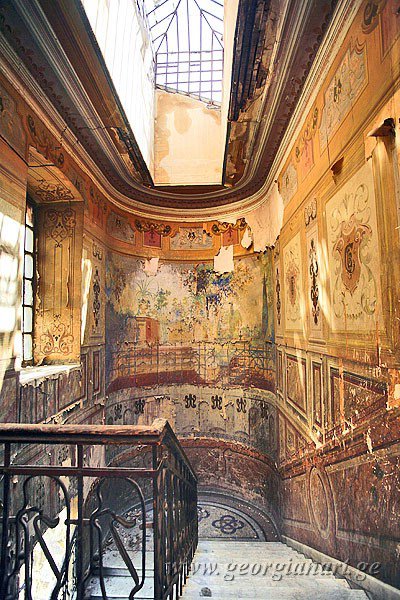
Find the location of a particular element. mosaic tile is located at coordinates (209, 526), (129, 537), (149, 542), (203, 512), (250, 530), (259, 519).